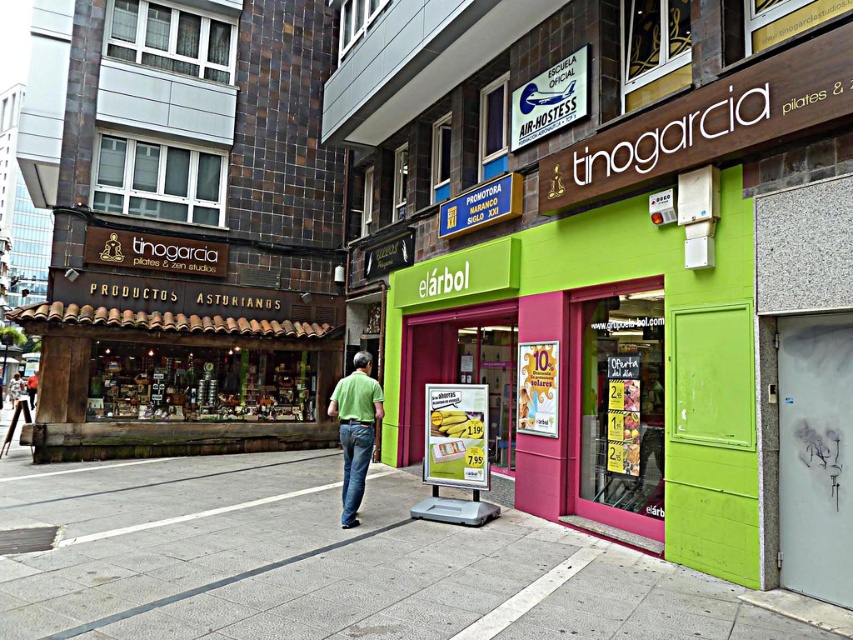
You are a delivery person standing at the corner of the street. You need to deliver a package to the shop located at point (384, 520). However, there is an obstacle at point (344, 513). Can you safely navigate around the obstacle to reach your destination?

Point (384, 520) is behind point (344, 513), so you can navigate around the obstacle by going around the back of point (344, 513) to reach point (384, 520) safely.

You are standing at the point labeled as point (x=325, y=563) in the image. Which object are you standing on?

You are standing on the gray concrete sidewalk at center.